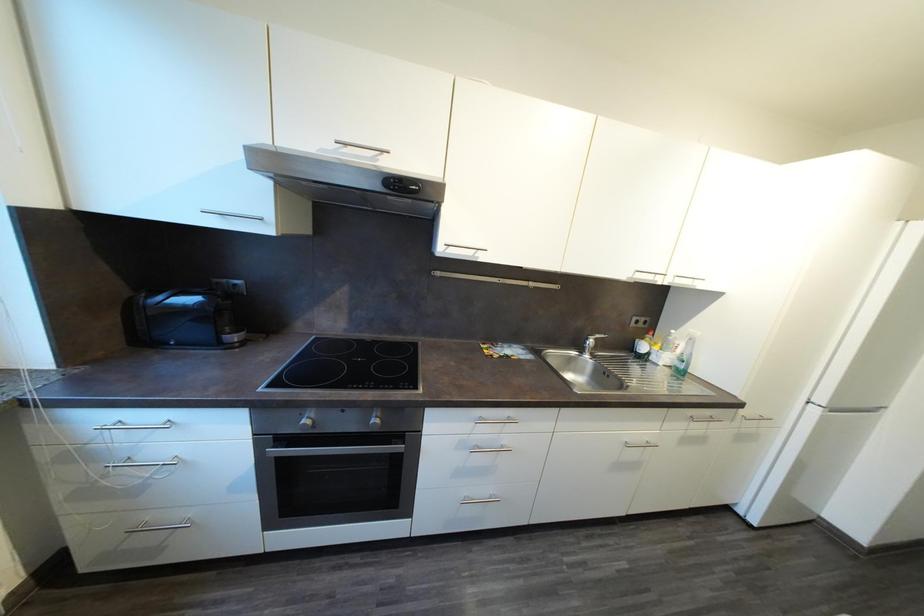
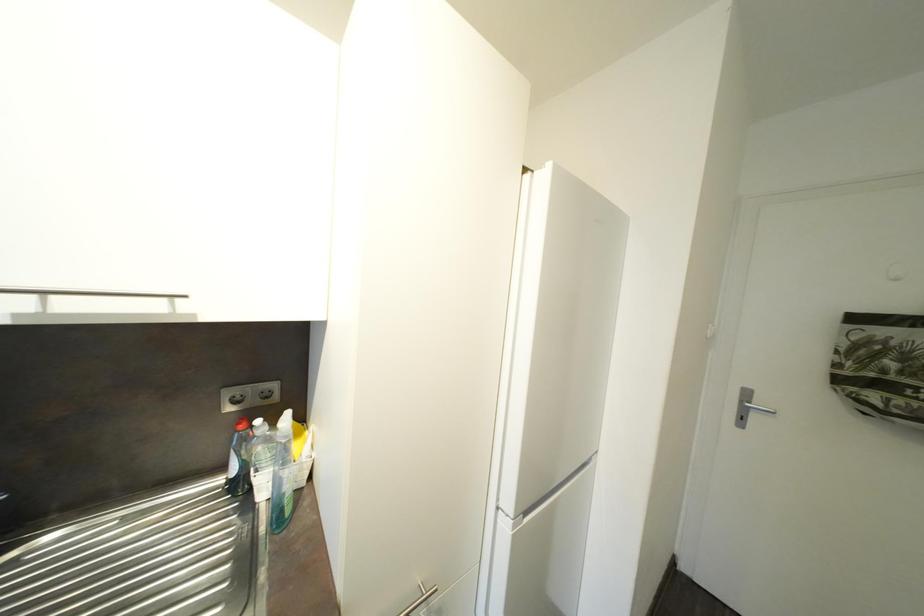
The images are taken continuously from a first-person perspective. In which direction are you moving?

The cameraman moved toward right, forward.